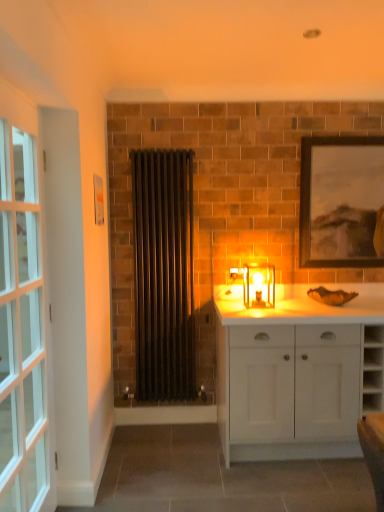
Question: Is clear glass door at left taller or shorter than black metal radiator at center?

Choices:
 (A) tall
 (B) short

Answer: (A)

Question: In the image, is clear glass door at left positioned in front of or behind black metal radiator at center?

Choices:
 (A) behind
 (B) front

Answer: (B)

Question: Considering the real-world distances, which object is farthest from the clear glass door at left?

Choices:
 (A) white matte cabinet at center
 (B) translucent glass candle at center
 (C) wooden framed artwork at upper right
 (D) black metal radiator at center

Answer: (C)

Question: Which object is positioned farthest from the white matte cabinet at center?

Choices:
 (A) wooden framed artwork at upper right
 (B) translucent glass candle at center
 (C) black metal radiator at center
 (D) clear glass door at left

Answer: (D)